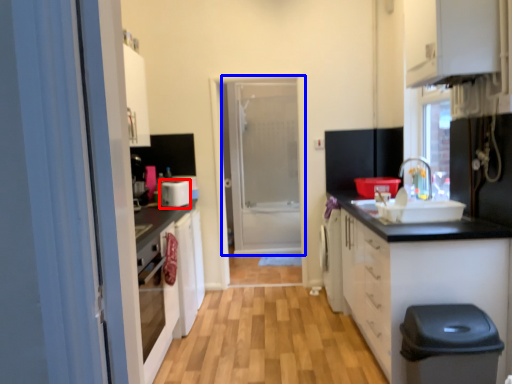
Question: Which point is further to the camera, appliance (highlighted by a red box) or door (highlighted by a blue box)?

Choices:
 (A) appliance
 (B) door

Answer: (B)